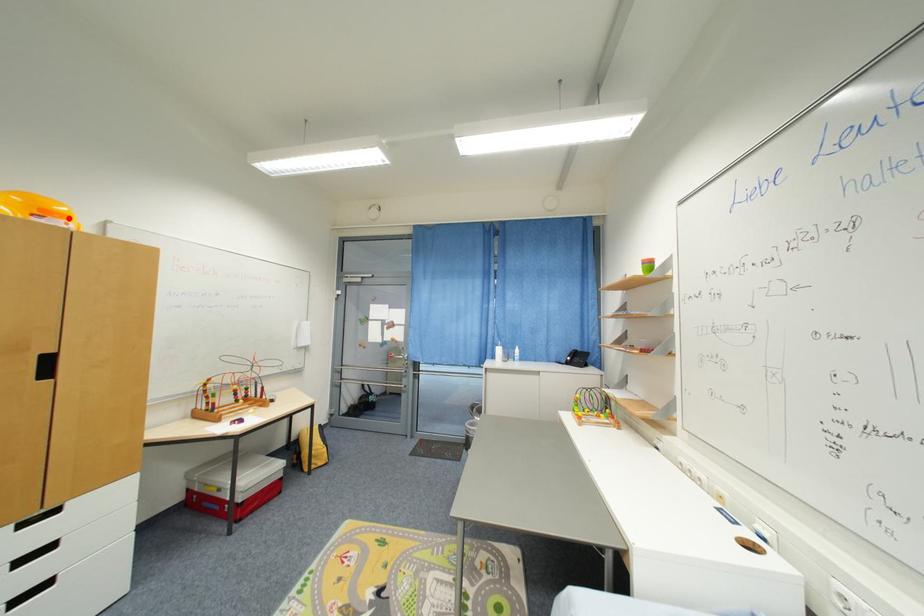
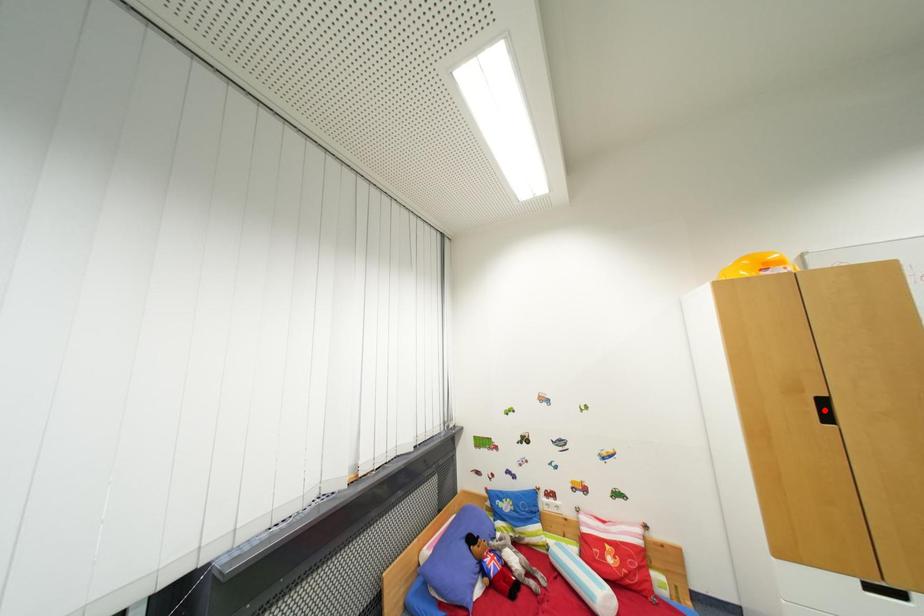
I am providing you with two images of the same scene from different viewpoints. A red point is marked on the first image and another point is marked on the second image. Is the red point in image1 aligned with the point shown in image2?

No